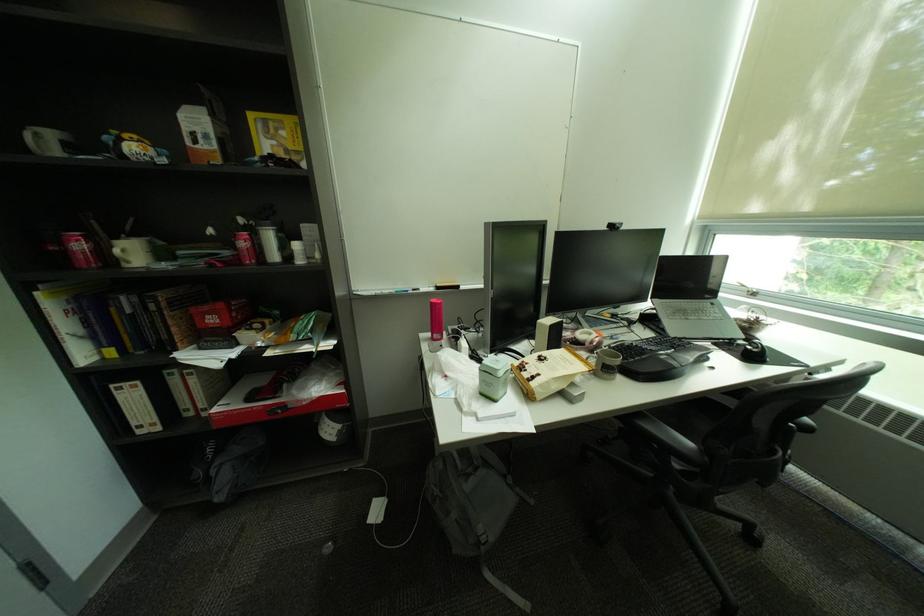
Describe the element at coordinates (614, 225) in the screenshot. I see `the black window latch` at that location.